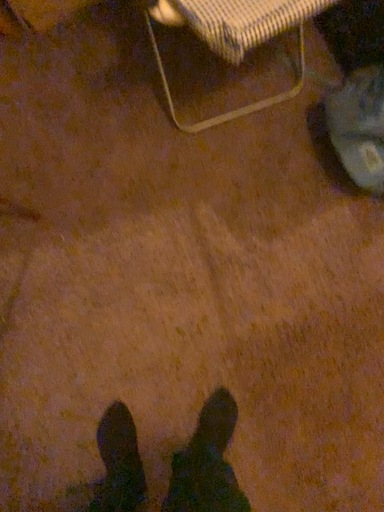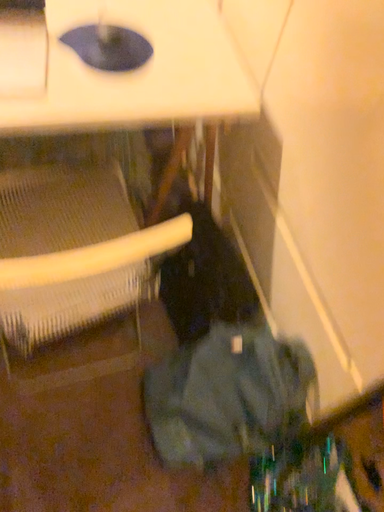
Question: How did the camera likely rotate when shooting the video?

Choices:
 (A) rotated downward
 (B) rotated upward

Answer: (B)